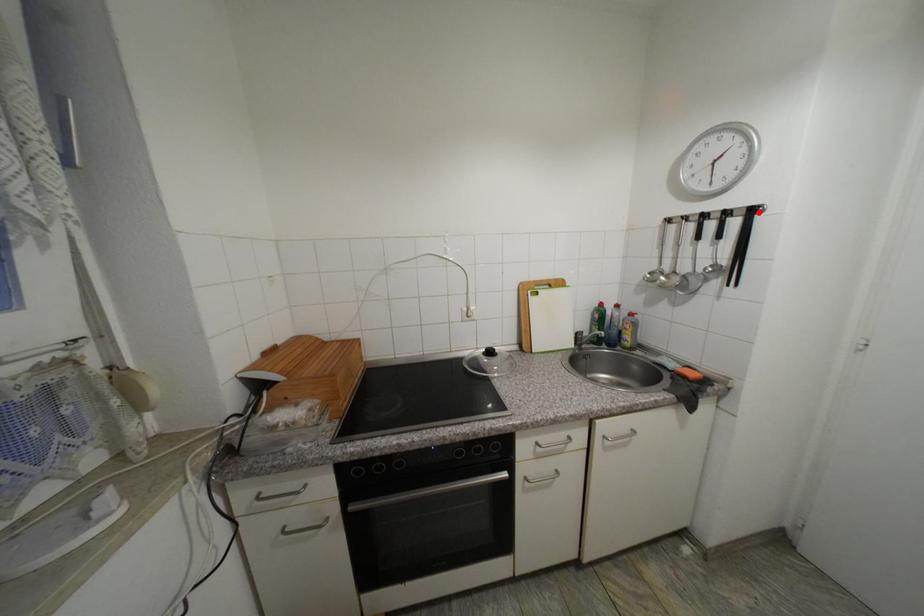
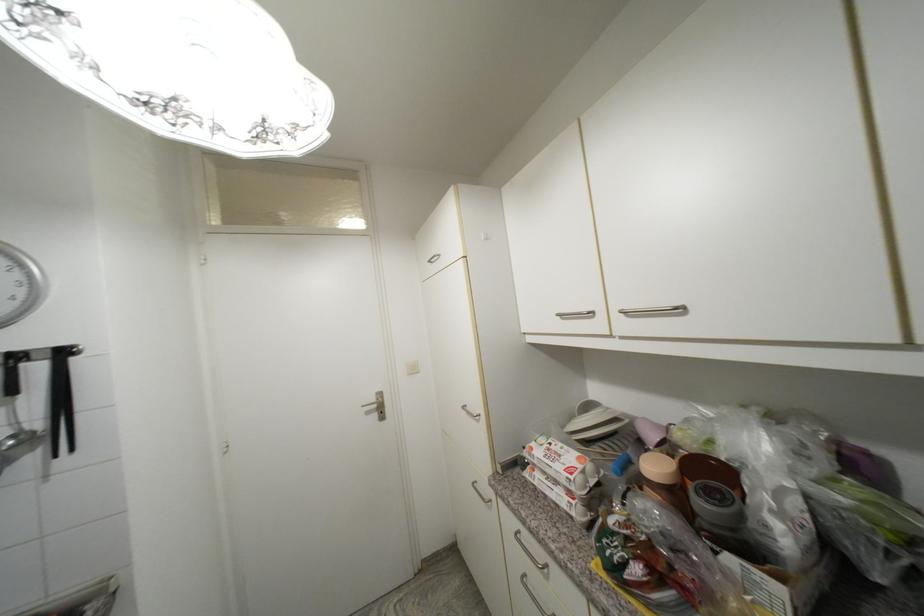
Where in the second image is the point corresponding to the highlighted location from the first image?

(69, 354)